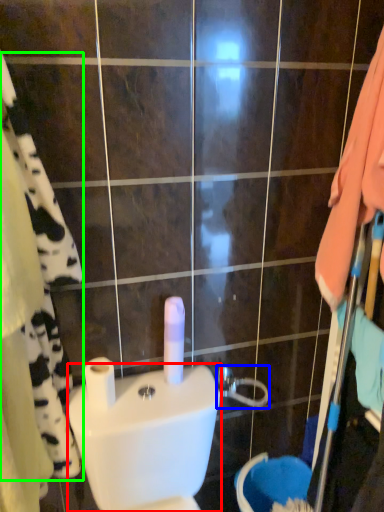
Question: Considering the real-world distances, which object is closest to toilet bowl (highlighted by a red box)? shower (highlighted by a blue box) or bath towel (highlighted by a green box).

Choices:
 (A) shower
 (B) bath towel

Answer: (B)